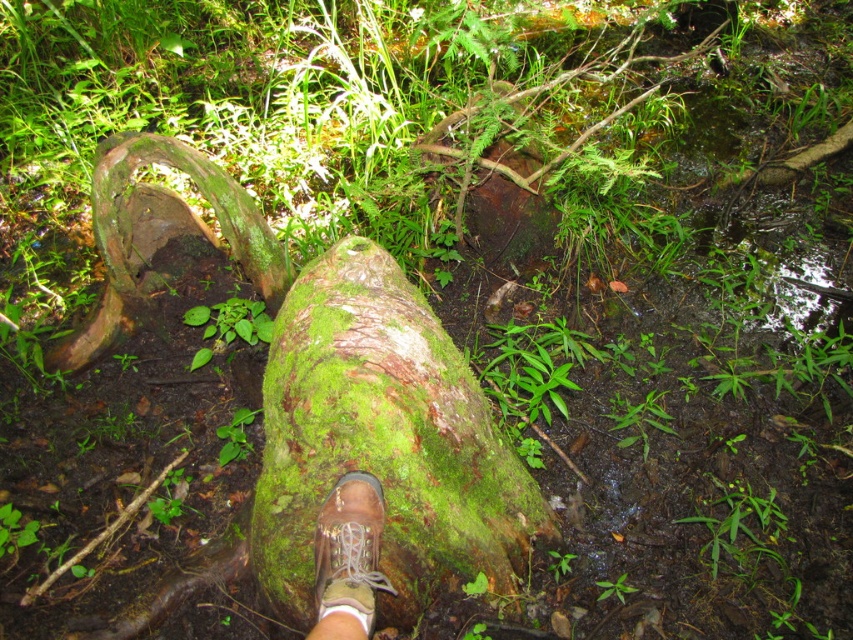
You are planning to place a small decorative stone on the green mossy log at center. Considering the size of the brown leather boot at center, will the log be able to support the stone without the boot interfering?

The green mossy log at center is larger in size than the brown leather boot at center, so there is enough space around the boot to place the stone on the log without interference.

Based on the photo, you are a hiker walking through the forest and notice the green mossy log at center and the brown leather boot at center. Which object is closer to you?

The brown leather boot at center is closer to you because the green mossy log at center is further away.

You are trying to cross a forest path and need to step over the green mossy log at center. Your hiking boot is the brown leather boot at center. Can your boot fit entirely on top of the log without hanging over the edges?

The green mossy log at center might be wider than brown leather boot at center, so there is a possibility that the boot can fit entirely on the log. However, since the width comparison is uncertain, it is recommended to check the actual dimensions before stepping.